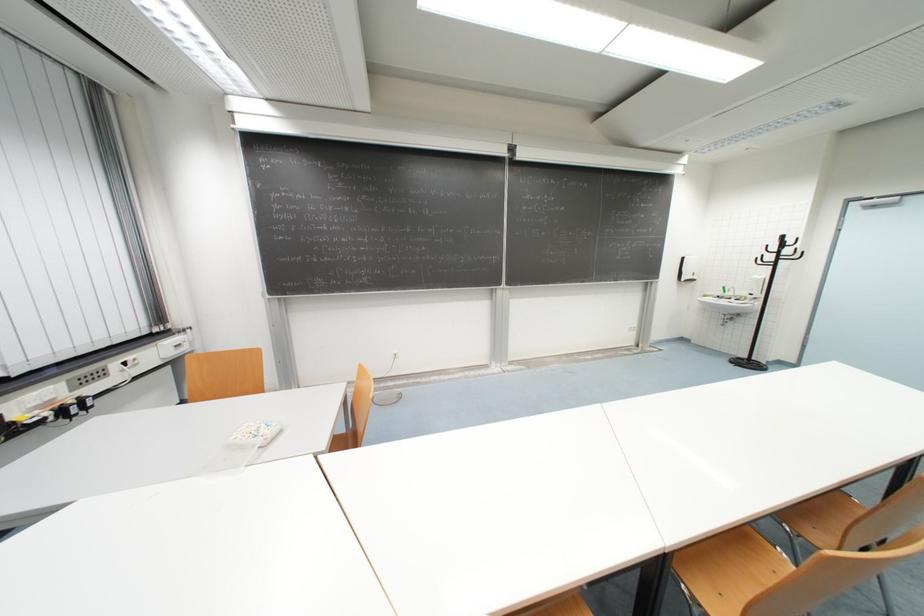
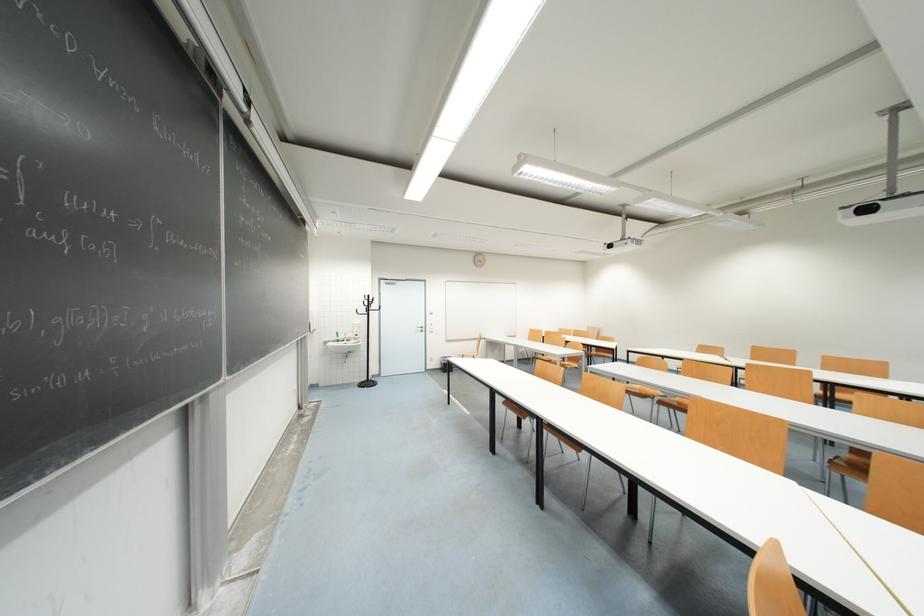
In the second image, find the point that corresponds to pixel 789 238 in the first image.

(373, 298)